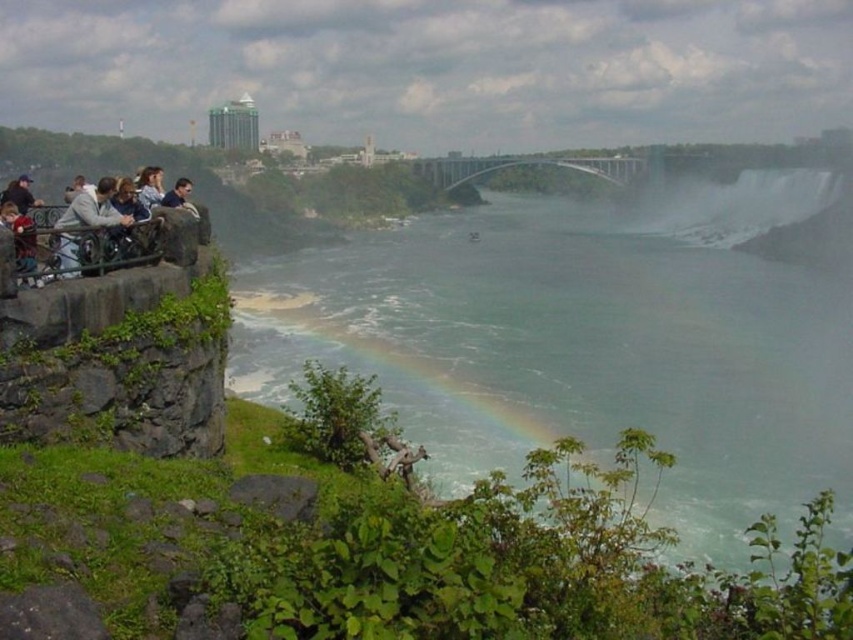
How far apart are translucent misty water at center and light brown leather jacket at left?

They are 130.27 meters apart.

Does translucent misty water at center have a greater height compared to light brown leather jacket at left?

Indeed, translucent misty water at center has a greater height compared to light brown leather jacket at left.

This screenshot has height=640, width=853. What are the coordinates of `translucent misty water at center` in the screenshot? It's located at (589, 342).

Does translucent misty water at center appear over light gray concrete railing at left?

Yes, translucent misty water at center is above light gray concrete railing at left.

This screenshot has width=853, height=640. I want to click on translucent misty water at center, so point(589,342).

At what (x,y) coordinates should I click in order to perform the action: click on translucent misty water at center. Please return your answer as a coordinate pair (x, y). Looking at the image, I should click on (589, 342).

Looking at this image, who is lower down, light gray concrete railing at left or light brown leather jacket at left?

light gray concrete railing at left is below.

Is light gray concrete railing at left positioned at the back of light brown leather jacket at left?

No, it is in front of light brown leather jacket at left.

The width and height of the screenshot is (853, 640). What do you see at coordinates (86, 221) in the screenshot?
I see `light gray concrete railing at left` at bounding box center [86, 221].

Where is `light gray concrete railing at left`? light gray concrete railing at left is located at coordinates (86, 221).